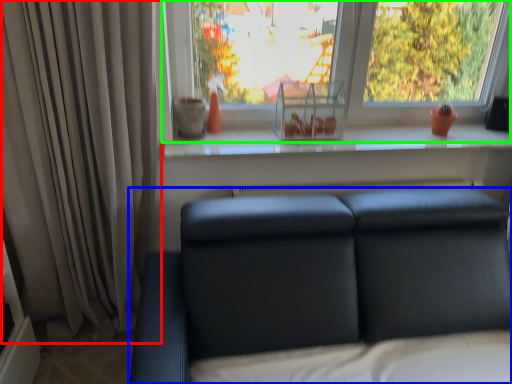
Question: Based on their relative distances, which object is farther from curtain (highlighted by a red box)? Choose from studio couch (highlighted by a blue box) and window (highlighted by a green box).

Choices:
 (A) studio couch
 (B) window

Answer: (B)